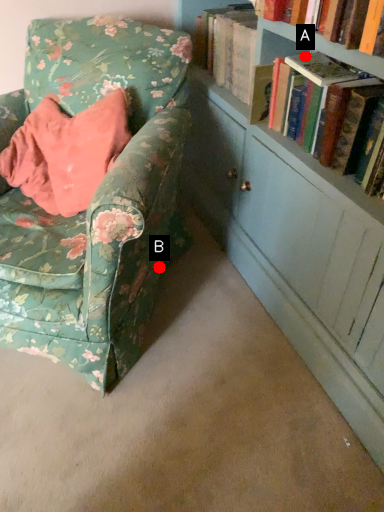
Question: Two points are circled on the image, labeled by A and B beside each circle. Which point appears closest to the camera in this image?

Choices:
 (A) A is closer
 (B) B is closer

Answer: (A)